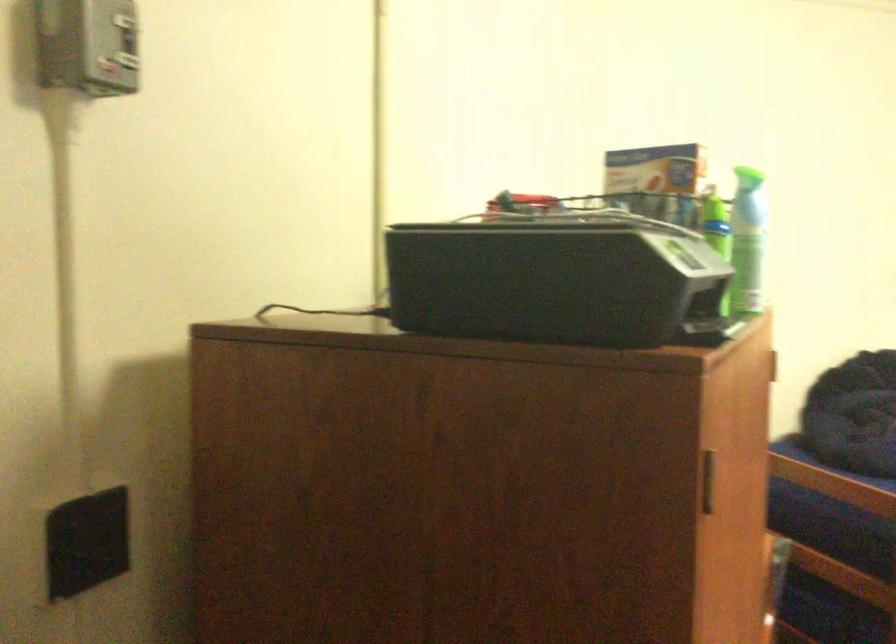
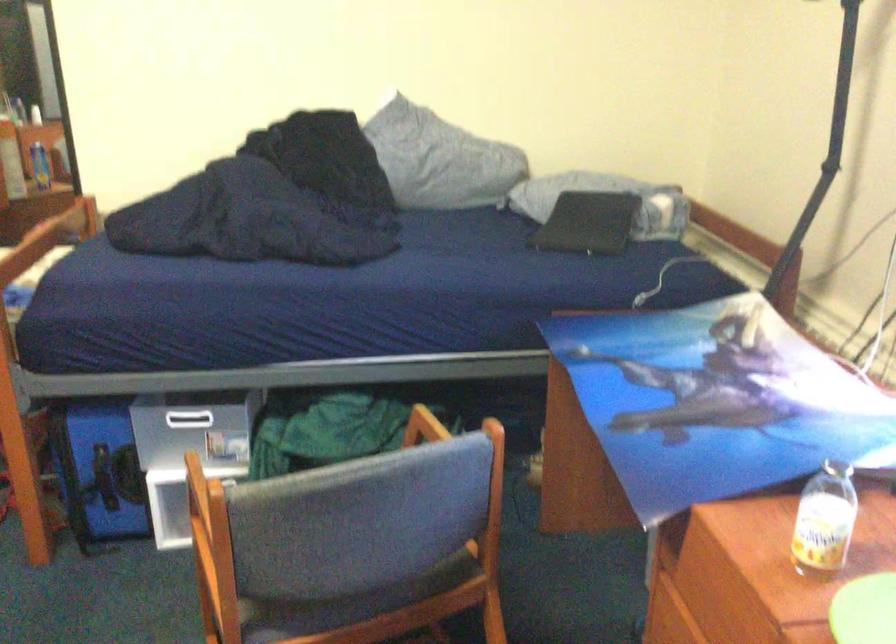
Question: Which direction would the cameraman need to move to produce the second image? Reply with the corresponding letter.

Choices:
 (A) Left
 (B) Right
 (C) Forward
 (D) Backward

Answer: (B)